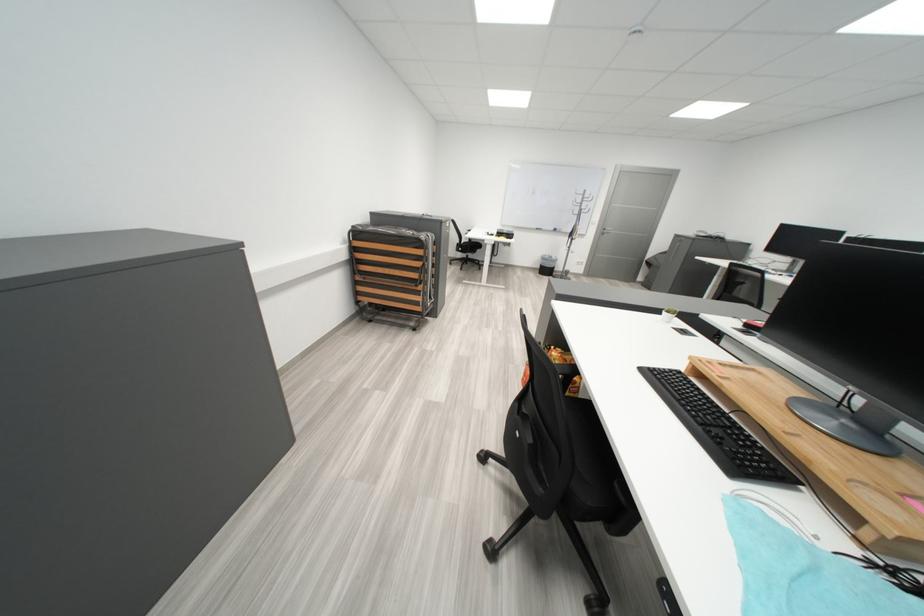
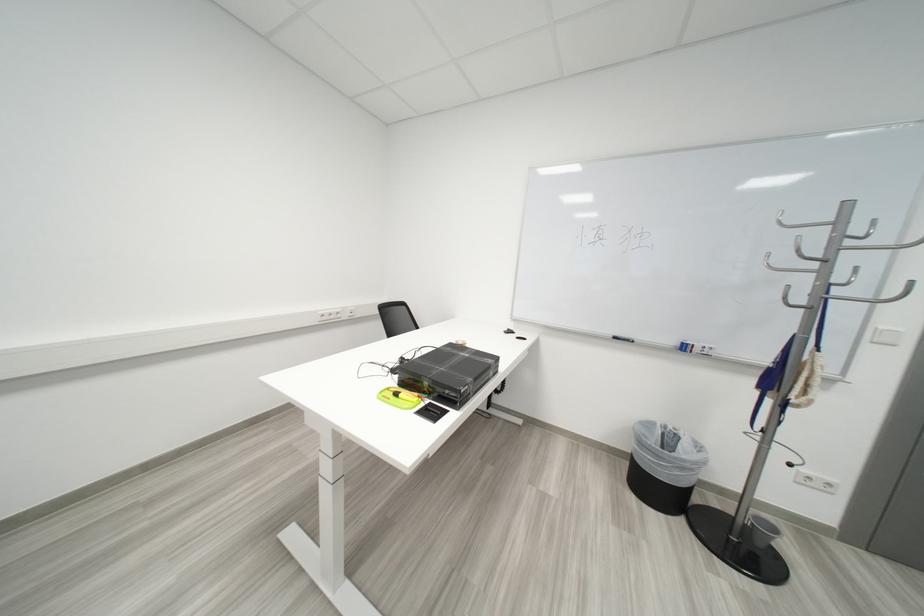
The point at (568,232) is marked in the first image. Where is the corresponding point in the second image?

(698, 350)